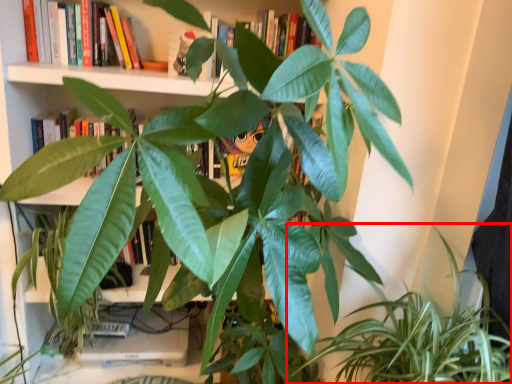
Question: In this image, where is houseplant (annotated by the red box) located relative to book?

Choices:
 (A) right
 (B) left

Answer: (A)